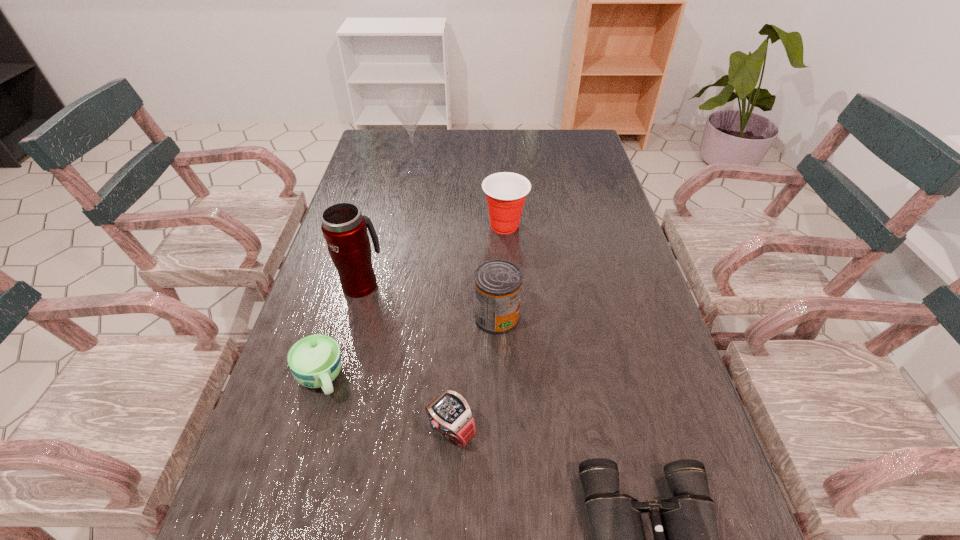
You are a GUI agent. You are given a task and a screenshot of the screen. Output one action in this format:
    pyautogui.click(x=<x>, y=<y>)
    Task: Click on the farthest object
    This screenshot has height=540, width=960.
    Given the screenshot: What is the action you would take?
    pyautogui.click(x=408, y=104)

The height and width of the screenshot is (540, 960). In order to click on thermos bottle in this screenshot , I will do `click(344, 228)`.

The image size is (960, 540). Identify the location of the sixth nearest object. (506, 192).

This screenshot has width=960, height=540. I want to click on the farther cup, so click(506, 192).

Where is `the fourth farthest object`? The image size is (960, 540). the fourth farthest object is located at coordinates (497, 283).

Identify the location of watch. (449, 413).

Locate an element on the screen. The image size is (960, 540). the shorter cup is located at coordinates (315, 361).

Locate an element on the screen. The width and height of the screenshot is (960, 540). the third nearest object is located at coordinates (315, 361).

Find the location of a particular element. The height and width of the screenshot is (540, 960). blank area located 0.110m on the right of the flute glass is located at coordinates (469, 168).

I want to click on free spot located on the side with the handle of the third farthest object, so click(375, 232).